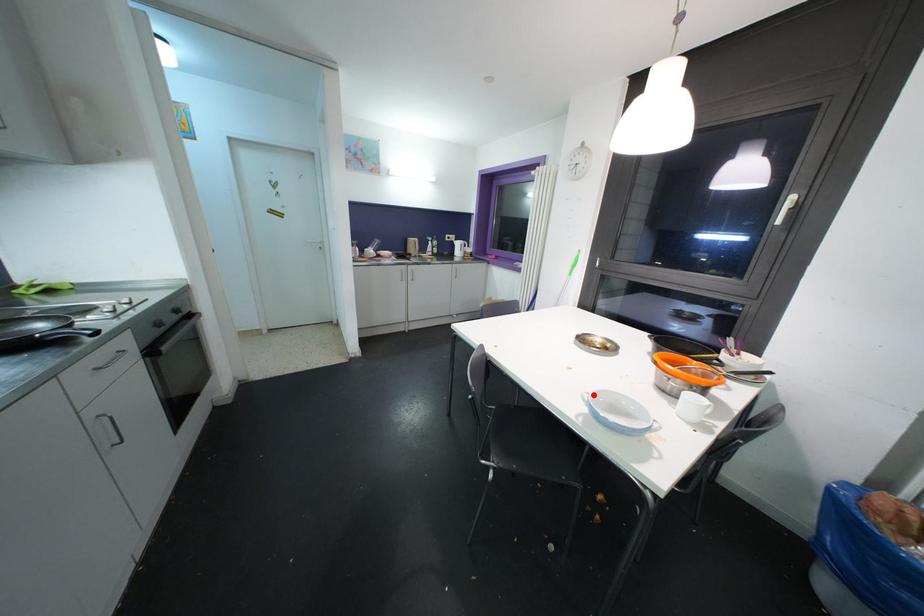
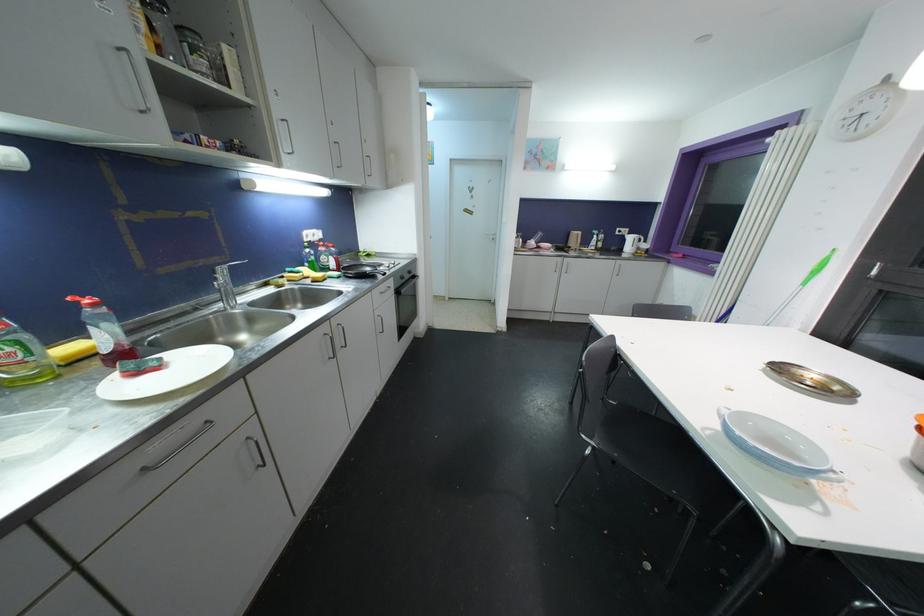
Question: I am providing you with two images of the same scene from different viewpoints. A red point is shown in image1. For the corresponding object point in image2, is it positioned nearer or farther from the camera?

Choices:
 (A) Nearer
 (B) Farther

Answer: (B)